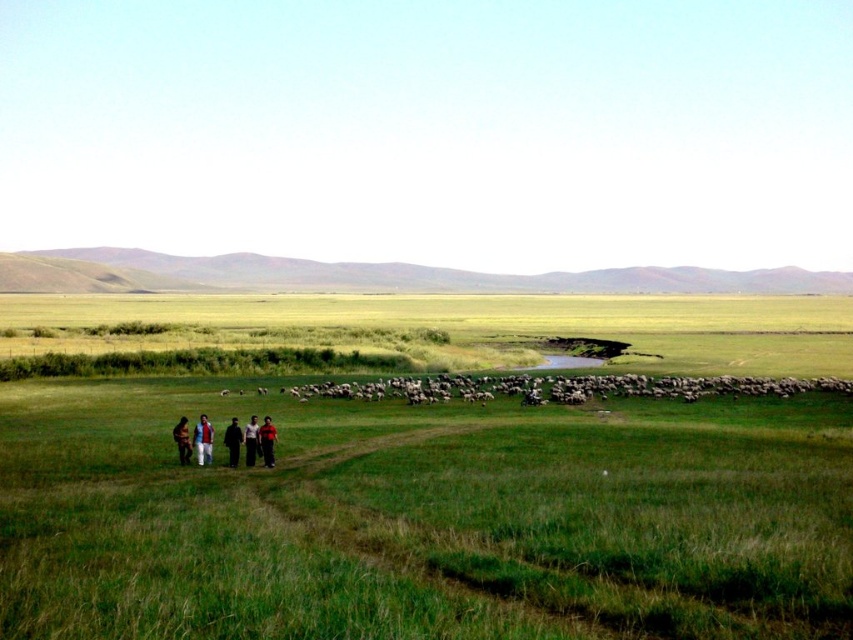
Describe the element at coordinates (265, 442) in the screenshot. I see `dark brown leather jacket at lower center` at that location.

Does point (270, 467) lie in front of point (189, 448)?

Yes, it is in front of point (189, 448).

Who is more distant from viewer, (268, 436) or (184, 422)?

Positioned behind is point (184, 422).

Identify the location of dark brown leather jacket at lower center. This screenshot has height=640, width=853. (265, 442).

Which is more to the right, green grassy field at center or light brown fabric jacket at lower left?

Positioned to the right is green grassy field at center.

Does green grassy field at center come in front of light brown fabric jacket at lower left?

Yes, it is in front of light brown fabric jacket at lower left.

Measure the distance between point (32, 445) and camera.

Point (32, 445) and camera are 130.72 feet apart from each other.

The width and height of the screenshot is (853, 640). I want to click on green grassy field at center, so click(421, 516).

Does green grassy field at center have a greater width compared to dark brown leather jacket at lower left?

Indeed, green grassy field at center has a greater width compared to dark brown leather jacket at lower left.

Is green grassy field at center in front of dark brown leather jacket at lower left?

Yes, green grassy field at center is in front of dark brown leather jacket at lower left.

This screenshot has width=853, height=640. What do you see at coordinates (421, 516) in the screenshot?
I see `green grassy field at center` at bounding box center [421, 516].

Locate an element on the screen. This screenshot has height=640, width=853. green grassy field at center is located at coordinates (421, 516).